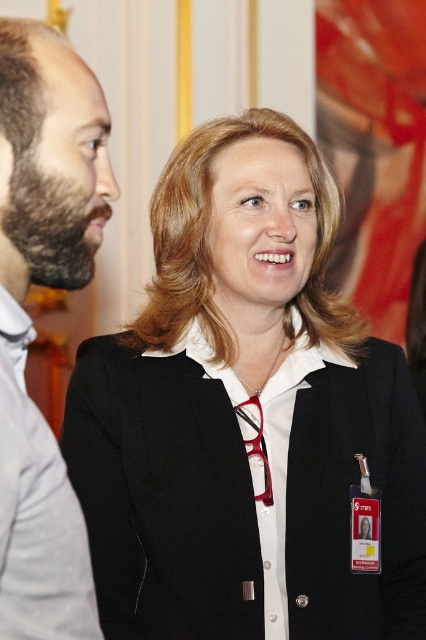
You are standing in front of the two people in the image. The point at coordinates (244, 493) is marked on the image. Which object does this point correspond to?

The point at coordinates (244, 493) corresponds to the black matte blazer at center.

You are standing in a conference room and see the bearded man at left and the white cotton dress shirt at left. Which one is higher in the image?

The bearded man at left is located above the white cotton dress shirt at left, so the bearded man at left is higher in the image.

You are standing in a conference room and see the black matte blazer at center and the bearded man at left. Which one is closer to you?

The black matte blazer at center is closer to you than the bearded man at left because it is further to the viewer.